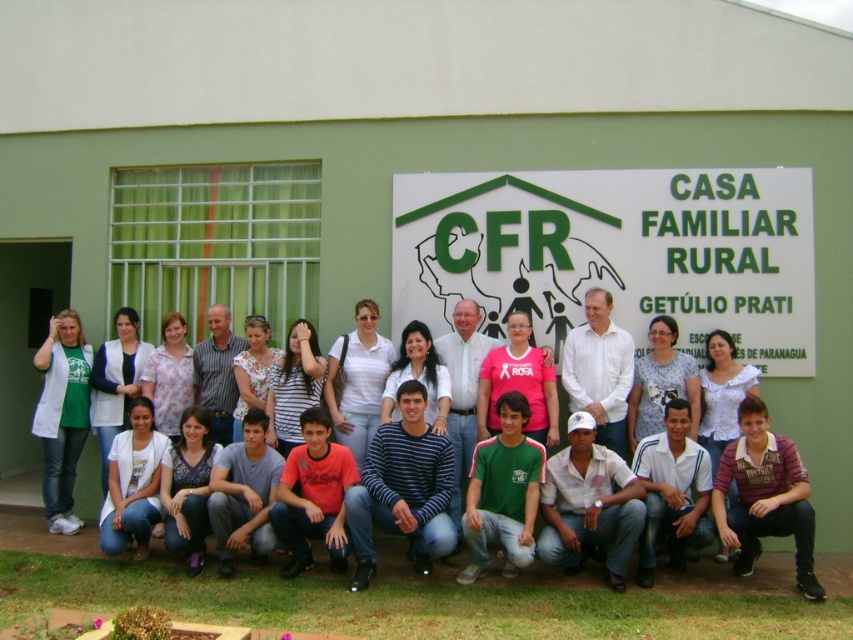
Question: Which point appears farthest from the camera in this image?

Choices:
 (A) (798, 460)
 (B) (494, 259)
 (C) (665, 337)

Answer: (B)

Question: Is striped cotton shirt at lower right behind white dotted blouse at center?

Choices:
 (A) no
 (B) yes

Answer: (A)

Question: Which of these objects is positioned closest to the white dotted blouse at center?

Choices:
 (A) white cotton shirt at lower left
 (B) green matte sign at center
 (C) gray striped shirt at center

Answer: (B)

Question: Is green matte sign at center below white cotton shirt at lower left?

Choices:
 (A) no
 (B) yes

Answer: (A)

Question: Which object is farther from the camera taking this photo?

Choices:
 (A) white cotton shirt at center
 (B) white matte shirt at center
 (C) pink fabric shirt at center

Answer: (A)

Question: Is green matte sign at center above gray striped shirt at center?

Choices:
 (A) no
 (B) yes

Answer: (B)